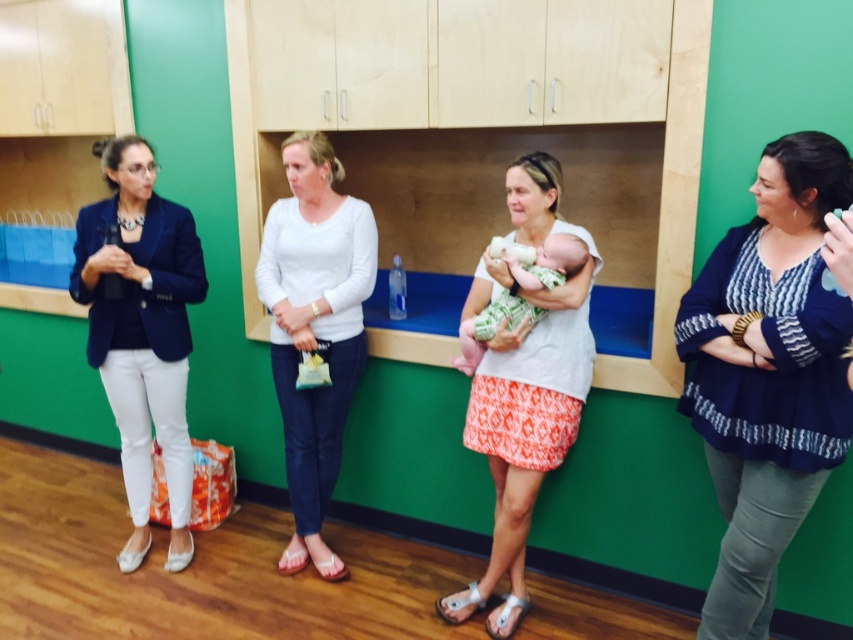
You are standing in the room and want to move from point A to point B. Point A is at coordinates point (x=563, y=380) and point B is at coordinates point (x=453, y=364). Which direction should you move to go from point A to point B?

To move from point A to point B, you should move backward since point A is in front of point B.

You are standing in the room and want to hand a document to both the person wearing the matte black blazer at left and the person wearing the white matte sweater at center. Which one should you approach first to ensure you can reach them without moving past the other?

You should approach the matte black blazer at left first because it is closer to you than the white matte sweater at center, so you can reach them without needing to move past the other person.